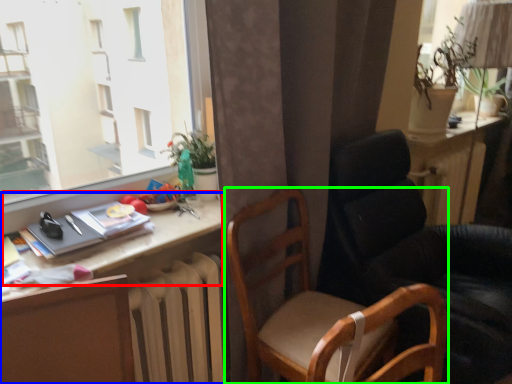
Question: Based on their relative distances, which object is nearer to table (highlighted by a red box)? Choose from desk (highlighted by a blue box) and chair (highlighted by a green box).

Choices:
 (A) desk
 (B) chair

Answer: (A)